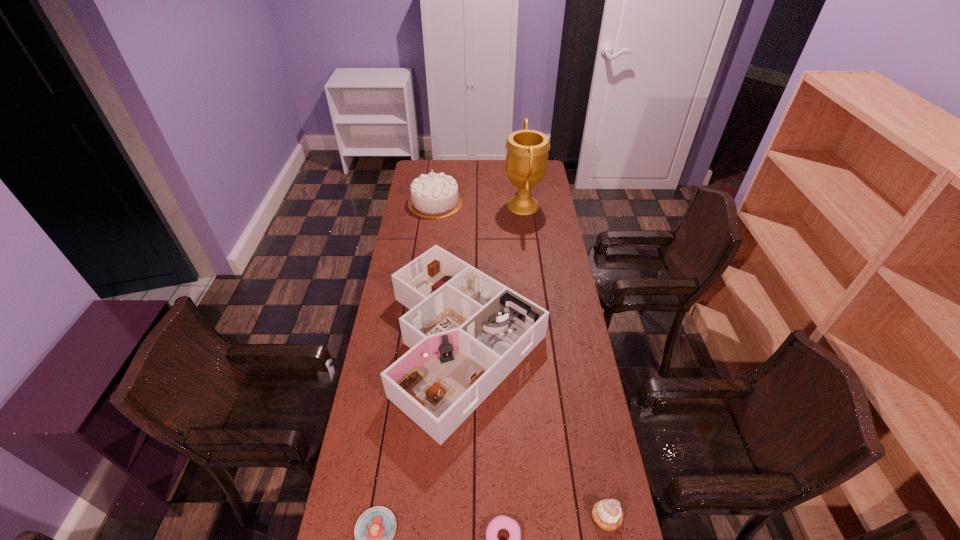
At what (x,y) coordinates should I click in order to perform the action: click on vacant region located on the front of the fourth nearest object. Please return your answer as a coordinate pair (x, y). The width and height of the screenshot is (960, 540). Looking at the image, I should click on (462, 538).

Image resolution: width=960 pixels, height=540 pixels. Find the location of `vacant space located 0.120m on the left of the third shortest object`. vacant space located 0.120m on the left of the third shortest object is located at coordinates (549, 516).

Locate an element on the screen. This screenshot has width=960, height=540. birthday cake that is at the left edge is located at coordinates (433, 195).

In order to click on dollhouse situated at the left edge in this screenshot , I will do `click(467, 332)`.

Image resolution: width=960 pixels, height=540 pixels. I want to click on trophy positioned at the right edge, so click(526, 161).

Locate an element on the screen. This screenshot has height=540, width=960. dollhouse present at the right edge is located at coordinates (467, 332).

Find the location of `pastry located at the right edge`. pastry located at the right edge is located at coordinates (607, 514).

Locate an element on the screen. The width and height of the screenshot is (960, 540). vacant area at the far edge of the desktop is located at coordinates (458, 170).

The height and width of the screenshot is (540, 960). Identify the location of free space at the left edge. (391, 360).

This screenshot has height=540, width=960. In the image, there is a desktop. In order to click on vacant space at the right edge in this screenshot , I will do `click(527, 225)`.